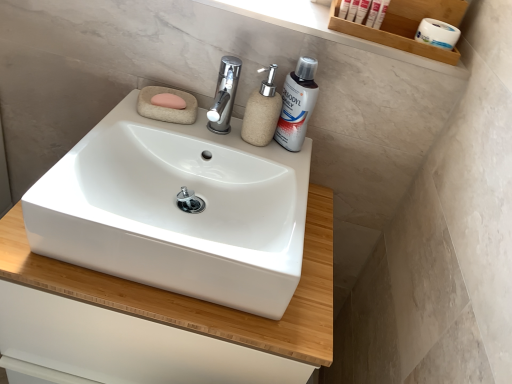
Question: Considering the positions of white matte tube at upper right and white plastic toothpaste at upper right, the first personal care from the right, in the image, is white matte tube at upper right taller or shorter than white plastic toothpaste at upper right, the first personal care from the right,?

Choices:
 (A) tall
 (B) short

Answer: (B)

Question: Based on their positions, is white matte tube at upper right located to the left or right of white plastic toothpaste at upper right, marked as the 2th personal care in a left-to-right arrangement?

Choices:
 (A) left
 (B) right

Answer: (B)

Question: Estimate the real-world distances between objects in this image. Which object is closer to the white plastic tubes at upper right, marked as the 2th personal care in a right-to-left arrangement?

Choices:
 (A) pink rubber soap at upper left
 (B) wooden shelf at upper right
 (C) chrome metallic tap at center
 (D) white plastic tube at upper right
 (E) white matte tube at upper right

Answer: (D)

Question: Estimate the real-world distances between objects in this image. Which object is closer to the beige textured soap dispenser at center?

Choices:
 (A) white matte tube at upper right
 (B) white plastic tubes at upper right, marked as the 2th personal care in a right-to-left arrangement
 (C) white matte toilet paper at upper right
 (D) white plastic toothpaste at upper right, the first personal care from the right
 (E) white matte cabinet at center

Answer: (B)